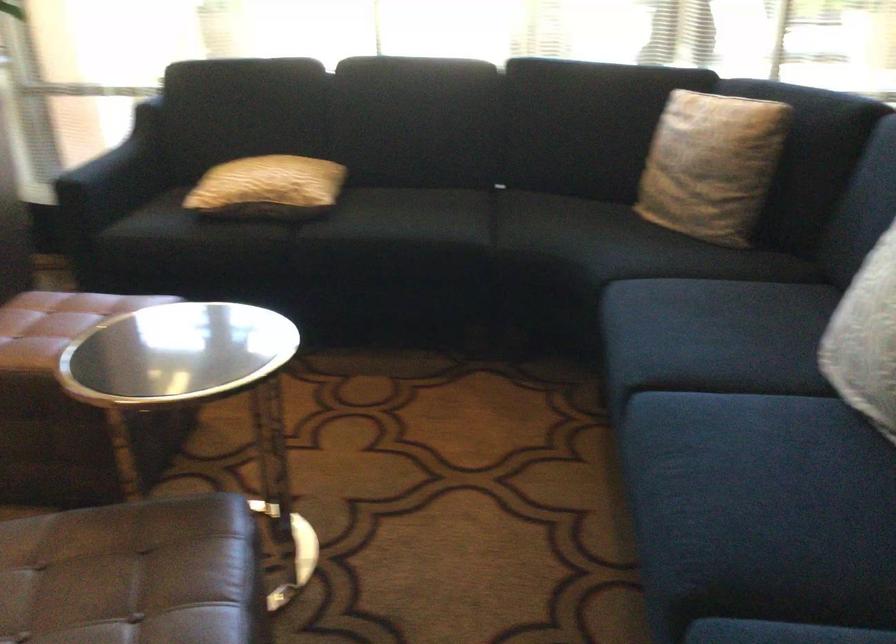
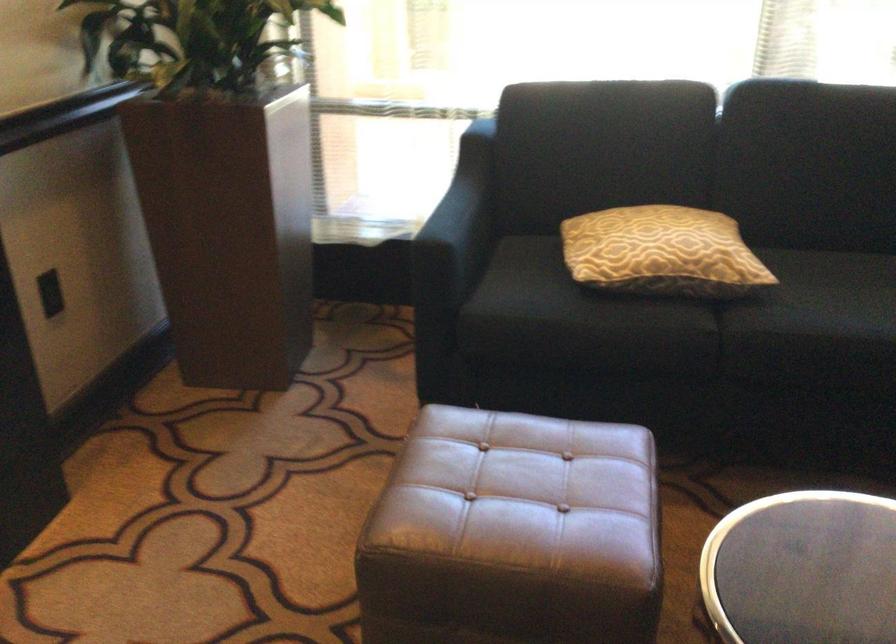
Where in the second image is the point corresponding to pixel 254 184 from the first image?

(661, 252)